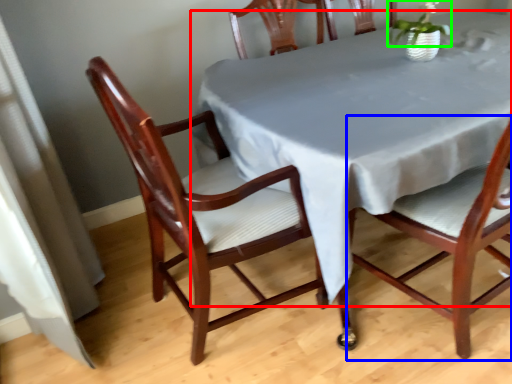
Question: Which object is the farthest from table (highlighted by a red box)? Choose among these: chair (highlighted by a blue box) or plant (highlighted by a green box).

Choices:
 (A) chair
 (B) plant

Answer: (B)